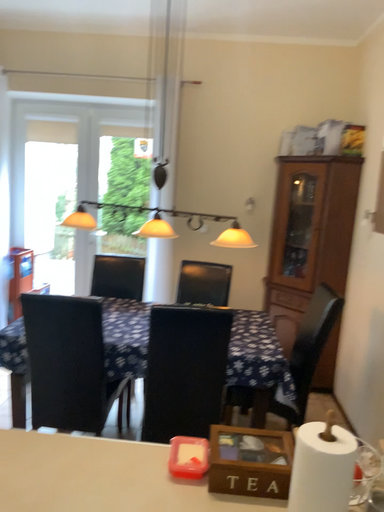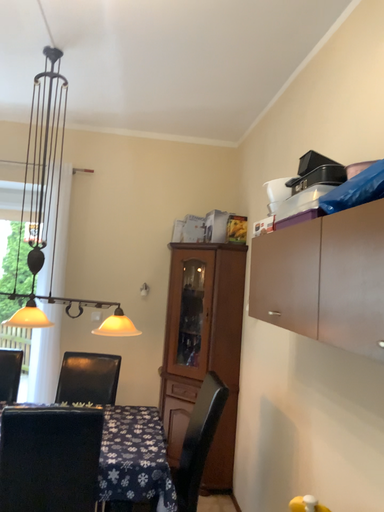
Question: Which way did the camera rotate in the video?

Choices:
 (A) rotated downward
 (B) rotated upward

Answer: (B)